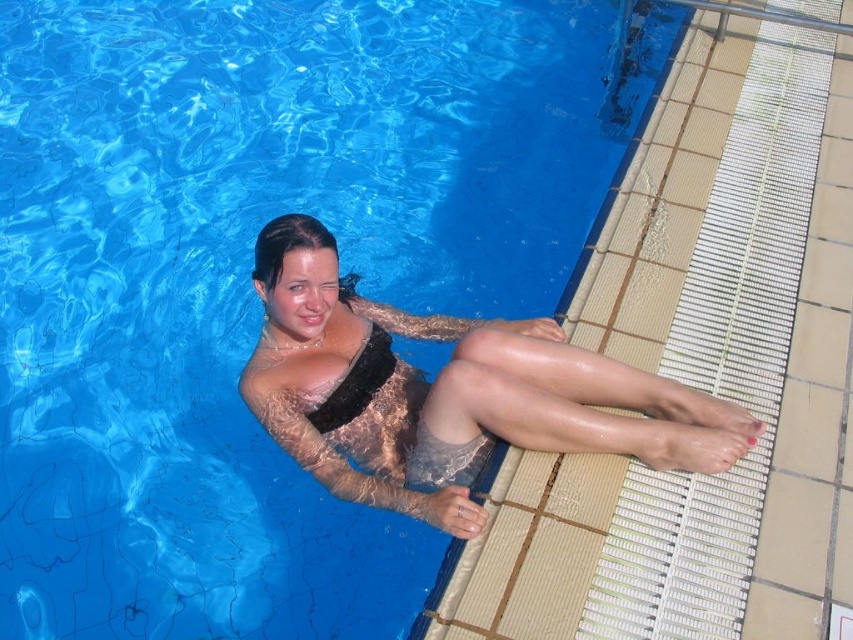
Does lace fabric swimsuit at center appear under black fuzzy bikini top at upper center?

Yes.

Can you confirm if lace fabric swimsuit at center is smaller than black fuzzy bikini top at upper center?

No.

Who is more distant from viewer, (438,435) or (329,394)?

Answer: Point (329,394)

What are the coordinates of `lace fabric swimsuit at center` in the screenshot? It's located at (447, 392).